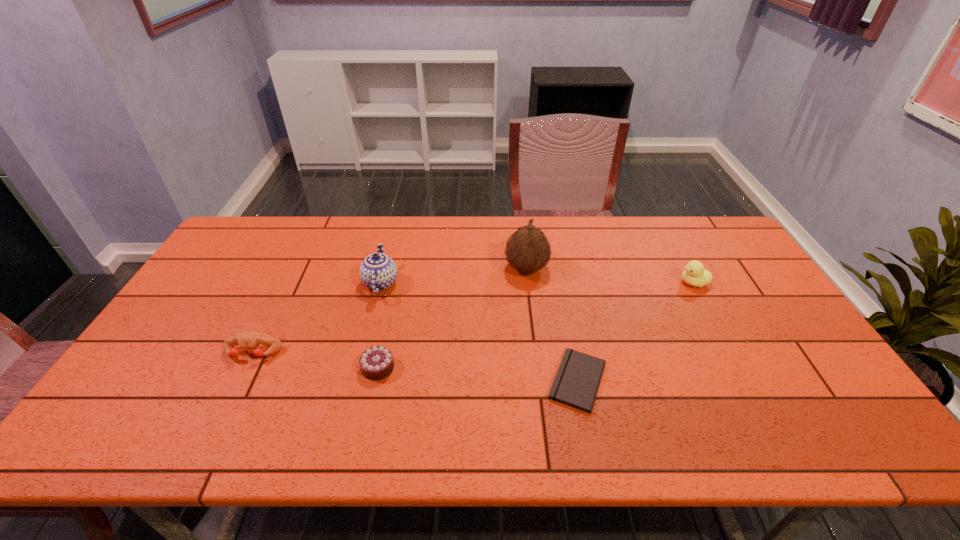
At what (x,y) coordinates should I click in order to perform the action: click on blank space that satisfies the following two spatial constraints: 1. with the gloves of the checkbook facing forward; 2. on the right side of the leftmost object. Please return your answer as a coordinate pair (x, y). Looking at the image, I should click on [239, 381].

The height and width of the screenshot is (540, 960). Identify the location of free spot that satisfies the following two spatial constraints: 1. on the surface of the tallest object; 2. with the gloves of the puncher facing forward. (537, 353).

Image resolution: width=960 pixels, height=540 pixels. I want to click on free space that satisfies the following two spatial constraints: 1. with the gloves of the checkbook facing forward; 2. on the right side of the puncher, so click(x=239, y=381).

Where is `vacant space that satisfies the following two spatial constraints: 1. on the surface of the tallest object; 2. with the gloves of the leftmost object facing forward`? This screenshot has height=540, width=960. vacant space that satisfies the following two spatial constraints: 1. on the surface of the tallest object; 2. with the gloves of the leftmost object facing forward is located at coordinates (537, 353).

This screenshot has width=960, height=540. I want to click on free spot that satisfies the following two spatial constraints: 1. on the surface of the coconut; 2. with the gloves of the leftmost object facing forward, so click(537, 353).

The image size is (960, 540). I want to click on free space that satisfies the following two spatial constraints: 1. on the surface of the coconut; 2. with the gloves of the leftmost object facing forward, so click(537, 353).

Locate an element on the screen. free space that satisfies the following two spatial constraints: 1. on the back side of the chocolate cake; 2. at the spout of the chinaware is located at coordinates (396, 283).

Where is `free space that satisfies the following two spatial constraints: 1. on the surface of the coconut; 2. with the gloves of the puncher facing forward`? free space that satisfies the following two spatial constraints: 1. on the surface of the coconut; 2. with the gloves of the puncher facing forward is located at coordinates (537, 353).